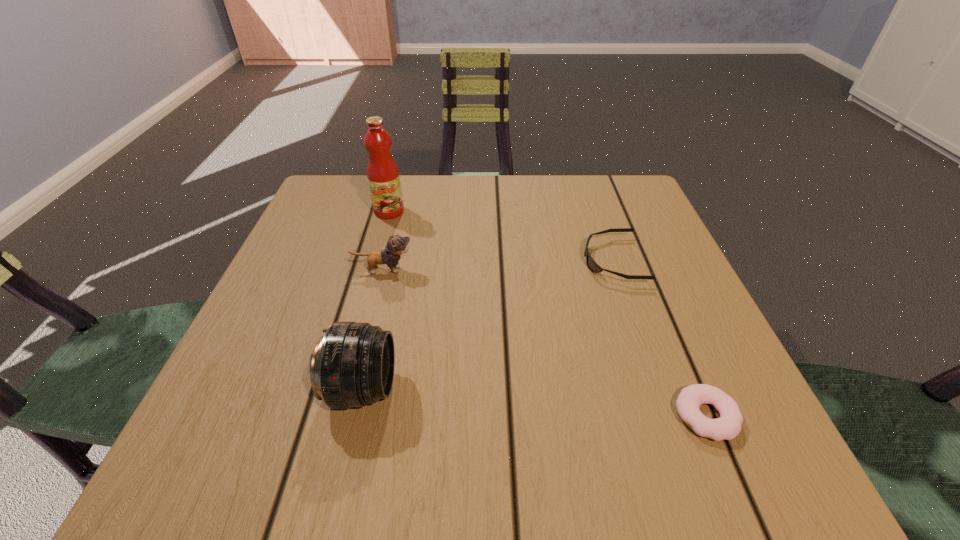
You are a GUI agent. You are given a task and a screenshot of the screen. Output one action in this format:
    pyautogui.click(x=<x>, y=<y>)
    Task: Click on the vacant area that lies between the tallest object and the sunglasses
    
    Given the screenshot: What is the action you would take?
    (x=501, y=236)

You are a GUI agent. You are given a task and a screenshot of the screen. Output one action in this format:
    pyautogui.click(x=<x>, y=<y>)
    Task: Click on the empty space that is in between the kitten and the doughnut
    The width and height of the screenshot is (960, 540).
    Given the screenshot: What is the action you would take?
    pyautogui.click(x=544, y=343)

Locate an element on the screen. vacant space that's between the tallest object and the sunglasses is located at coordinates 501,236.

Locate an element on the screen. This screenshot has width=960, height=540. vacant area between the fruit juice and the doughnut is located at coordinates (547, 314).

Find the location of a particular element. Image resolution: width=960 pixels, height=540 pixels. free space that is in between the kitten and the sunglasses is located at coordinates (498, 265).

This screenshot has height=540, width=960. Identify the location of vacant space that's between the farthest object and the fourth shortest object. (375, 300).

Image resolution: width=960 pixels, height=540 pixels. Identify the location of empty space that is in between the doughnut and the fruit juice. (547, 314).

You are a GUI agent. You are given a task and a screenshot of the screen. Output one action in this format:
    pyautogui.click(x=<x>, y=<y>)
    Task: Click on the empty location between the fruit juice and the doughnut
    The height and width of the screenshot is (540, 960).
    Given the screenshot: What is the action you would take?
    pyautogui.click(x=547, y=314)

Select which object is the second closest to the third shortest object. Please provide its 2D coordinates. Your answer should be formatted as a tuple, i.e. [(x, y)], where the tuple contains the x and y coordinates of a point satisfying the conditions above.

[(353, 364)]

Identify which object is the second closest to the second tallest object. Please provide its 2D coordinates. Your answer should be formatted as a tuple, i.e. [(x, y)], where the tuple contains the x and y coordinates of a point satisfying the conditions above.

[(592, 265)]